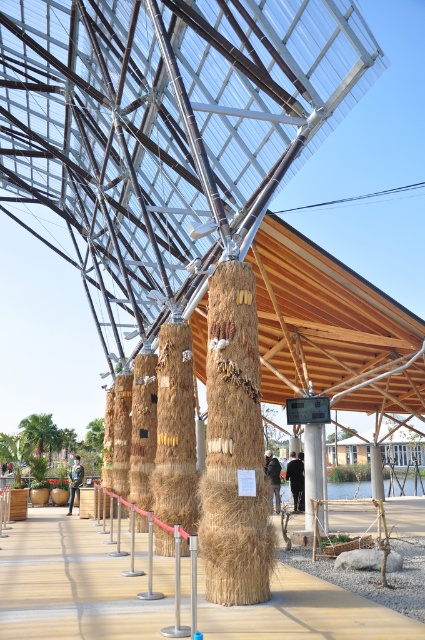
Is wooden walkway at center taller than braided straw column at center?

Indeed, wooden walkway at center has a greater height compared to braided straw column at center.

Is wooden walkway at center above braided straw column at center?

Incorrect, wooden walkway at center is not positioned above braided straw column at center.

I want to click on wooden walkway at center, so click(x=76, y=584).